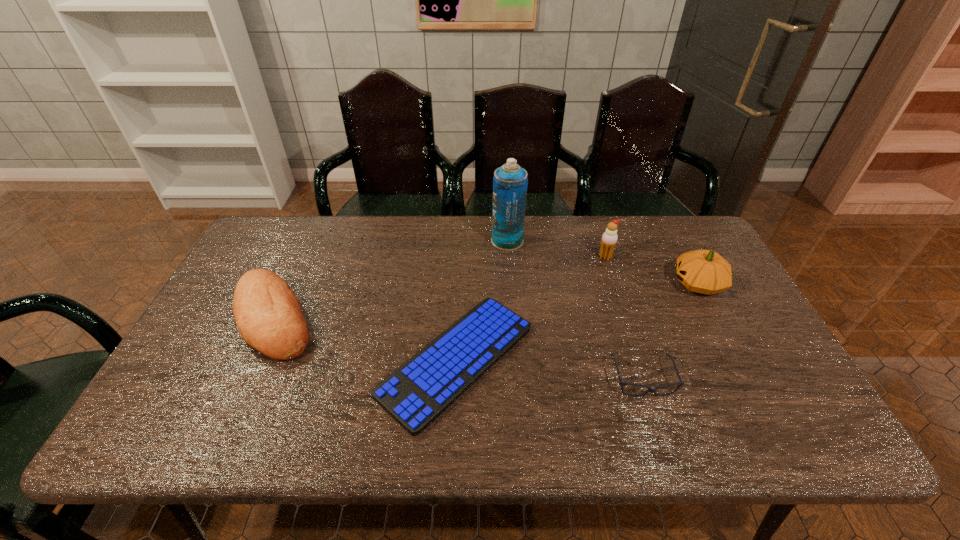
The image size is (960, 540). What are the coordinates of `vacant area situated at the front with a straw on the icecream` in the screenshot? It's located at (628, 327).

The width and height of the screenshot is (960, 540). Identify the location of vacant space situated 0.050m on the side of the gourd with the carved face. (655, 284).

Where is `vacant area situated 0.240m on the side of the gourd with the carved face`? This screenshot has width=960, height=540. vacant area situated 0.240m on the side of the gourd with the carved face is located at coordinates (591, 284).

Identify the location of vacant space situated on the side of the gourd with the carved face. (578, 284).

The image size is (960, 540). What are the coordinates of `free spot located on the back of the bread` in the screenshot? It's located at (305, 251).

Find the location of a particular element. This screenshot has width=960, height=540. free space located on the front-facing side of the spectacles is located at coordinates (663, 446).

Where is `free space located 0.110m on the right of the computer keyboard`? free space located 0.110m on the right of the computer keyboard is located at coordinates (577, 360).

Where is `aerosol can that is at the far edge`? The width and height of the screenshot is (960, 540). aerosol can that is at the far edge is located at coordinates (510, 181).

I want to click on icecream that is at the far edge, so click(x=609, y=239).

Where is `object situated at the near edge`? This screenshot has width=960, height=540. object situated at the near edge is located at coordinates (420, 390).